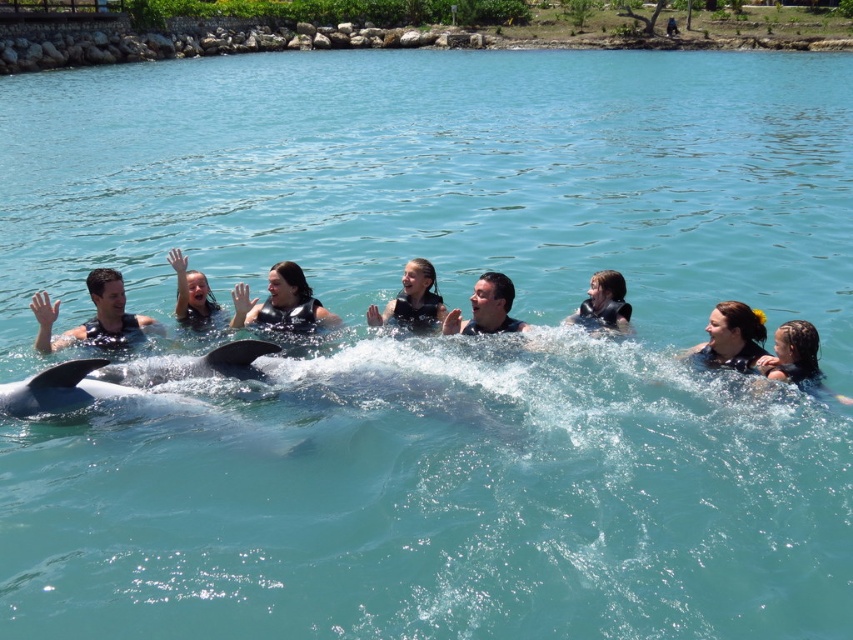
Who is positioned more to the left, black smooth whale at center or smooth black wetsuit at center?

Positioned to the left is black smooth whale at center.

Based on the photo, does black smooth whale at center appear under smooth black wetsuit at center?

Yes.

At what (x,y) coordinates should I click in order to perform the action: click on black smooth whale at center. Please return your answer as a coordinate pair (x, y). The image size is (853, 640). Looking at the image, I should click on (67, 387).

Which is in front, point (326, 310) or point (238, 301)?

Positioned in front is point (238, 301).

Can you confirm if black matte life vest at center is positioned to the right of smooth skin girl at center?

Indeed, black matte life vest at center is positioned on the right side of smooth skin girl at center.

What do you see at coordinates (289, 304) in the screenshot?
I see `black matte life vest at center` at bounding box center [289, 304].

Locate an element on the screen. This screenshot has height=640, width=853. black matte life vest at center is located at coordinates (289, 304).

Looking at this image, who is positioned more to the left, matte black swimwear at left or smooth skin man at center?

Positioned to the left is matte black swimwear at left.

Which is below, matte black swimwear at left or smooth skin man at center?

smooth skin man at center is lower down.

Where is `matte black swimwear at left`? Image resolution: width=853 pixels, height=640 pixels. matte black swimwear at left is located at coordinates (93, 316).